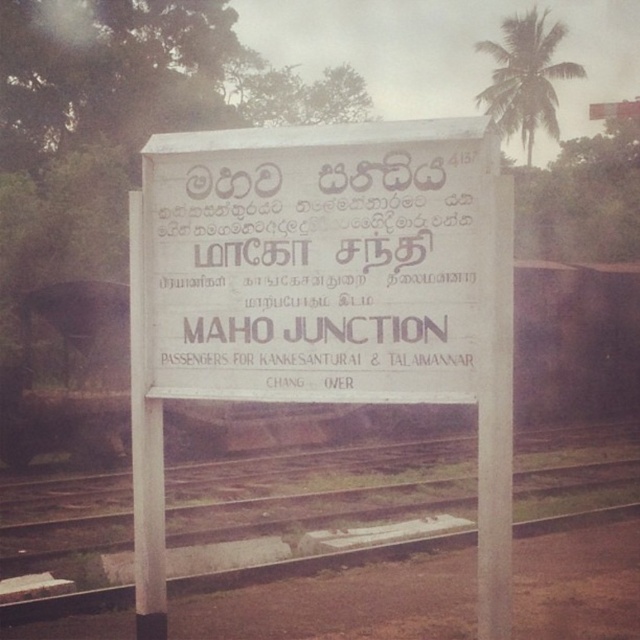
You are standing on the platform at MAHO JUNCTION station and need to locate the white paper sign at center. According to the scene description, where should you look relative to your position?

The white paper sign at center is located at the central area of the platform, so you should look straight ahead towards the middle of the platform to find it.

You are standing on the railway platform and see two points marked on the signboard. The first point is at coordinates point (266, 257) and the second point is at point (266, 497). Which point is closer to you?

Point (266, 257) is closer to the viewer than point (266, 497).

You are a traveler standing on the platform and need to find the white matte sign at center. According to the scene description, where should you look to locate it?

The white matte sign at center is located at point [323,298], so you should look towards the center of the platform where those coordinates indicate.